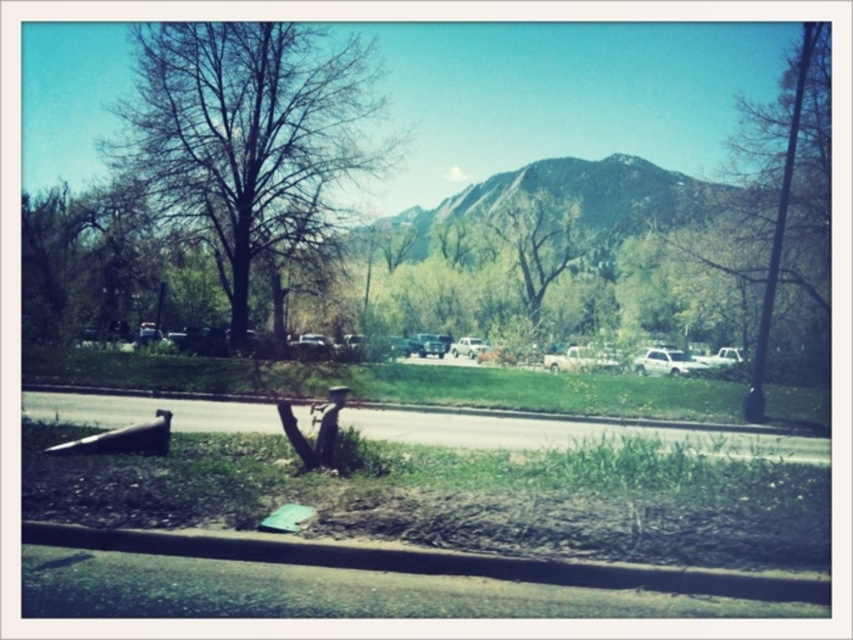
You are a delivery person trying to park your white matte truck at center in the parking lot. There is a brown concrete curb at lower center in the way. Can you drive over the curb to park?

The brown concrete curb at lower center is located below the white matte truck at center, meaning the truck is already positioned over the curb. Therefore, you cannot drive over the curb again as it is already in that position.

You are standing at the point labeled point (581, 348) in the parking lot. You need to walk to the point labeled point (80, 392), which is near the grassy area. Will you pass by the damaged fire hydrant on your way?

Since point (80, 392) is in front of point (581, 348), you will be moving towards the grassy area where the damaged fire hydrant is located. Therefore, yes, you will pass by the damaged fire hydrant on your way.